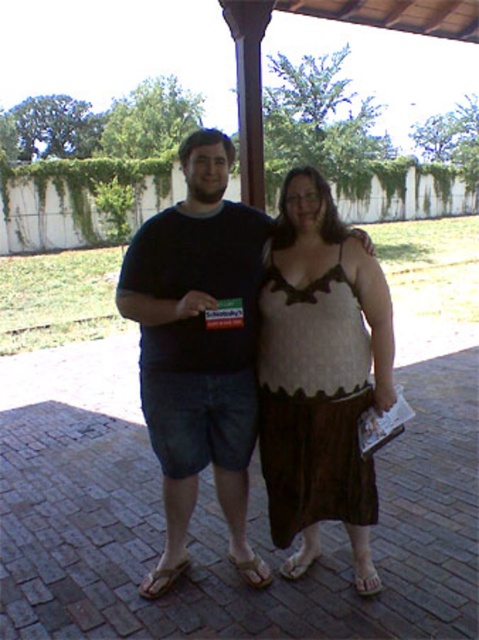
Question: Does brown textured skirt at center have a greater width compared to knitted brown dress at center?

Choices:
 (A) yes
 (B) no

Answer: (A)

Question: Where is brown textured skirt at center located in relation to knitted brown dress at center in the image?

Choices:
 (A) left
 (B) right

Answer: (A)

Question: Is brown textured skirt at center thinner than knitted brown dress at center?

Choices:
 (A) yes
 (B) no

Answer: (B)

Question: Which of the following is the closest to the observer?

Choices:
 (A) knitted brown dress at center
 (B) brown textured skirt at center

Answer: (B)